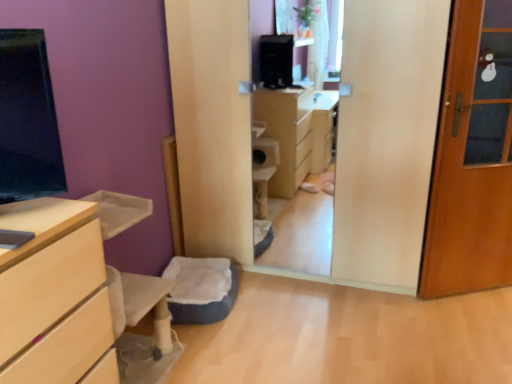
Question: From the image's perspective, would you say wooden door at right is positioned over light wood chest of drawers at left?

Choices:
 (A) yes
 (B) no

Answer: (A)

Question: Considering the relative positions of wooden door at right and light wood chest of drawers at left in the image provided, is wooden door at right to the left of light wood chest of drawers at left from the viewer's perspective?

Choices:
 (A) no
 (B) yes

Answer: (A)

Question: Is wooden door at right taller than light wood chest of drawers at left?

Choices:
 (A) yes
 (B) no

Answer: (A)

Question: Is wooden door at right smaller than light wood chest of drawers at left?

Choices:
 (A) yes
 (B) no

Answer: (A)

Question: From a real-world perspective, is wooden door at right on light wood chest of drawers at left?

Choices:
 (A) no
 (B) yes

Answer: (B)

Question: Can light wood chest of drawers at left be found inside wooden door at right?

Choices:
 (A) no
 (B) yes

Answer: (A)

Question: Is soft gray cushion at lower center located outside wooden door at right?

Choices:
 (A) no
 (B) yes

Answer: (B)

Question: Considering the relative sizes of soft gray cushion at lower center and wooden door at right in the image provided, is soft gray cushion at lower center bigger than wooden door at right?

Choices:
 (A) yes
 (B) no

Answer: (B)

Question: Considering the relative sizes of soft gray cushion at lower center and wooden door at right in the image provided, is soft gray cushion at lower center thinner than wooden door at right?

Choices:
 (A) no
 (B) yes

Answer: (A)

Question: Can you confirm if soft gray cushion at lower center is positioned to the left of wooden door at right?

Choices:
 (A) no
 (B) yes

Answer: (B)

Question: Does soft gray cushion at lower center have a lesser height compared to wooden door at right?

Choices:
 (A) yes
 (B) no

Answer: (A)

Question: Is soft gray cushion at lower center further to camera compared to wooden door at right?

Choices:
 (A) no
 (B) yes

Answer: (B)

Question: Can you confirm if wooden door at right is positioned to the right of soft gray cushion at lower center?

Choices:
 (A) no
 (B) yes

Answer: (B)